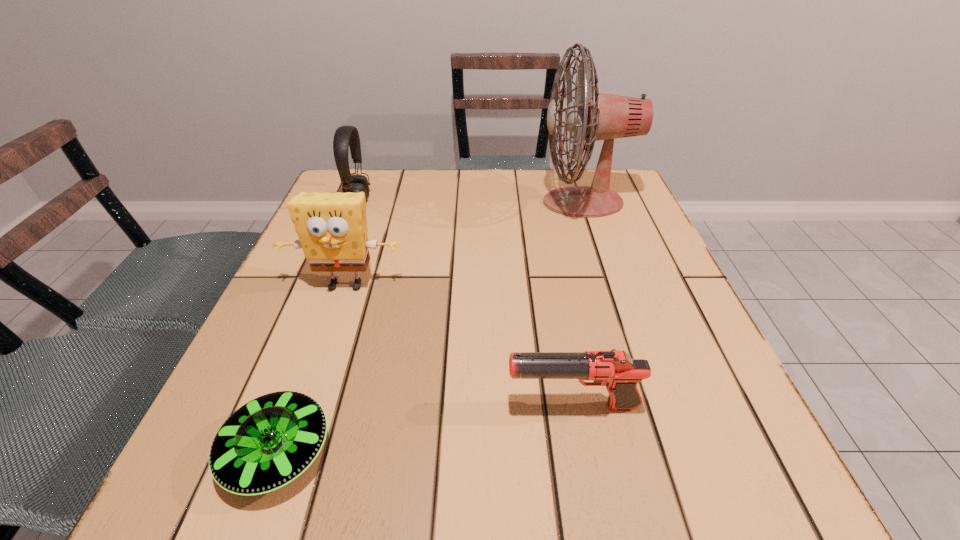
Locate an element on the screen. The height and width of the screenshot is (540, 960). fan positioned at the right edge is located at coordinates (594, 116).

Where is `gun located at the right edge`? gun located at the right edge is located at coordinates (616, 370).

Image resolution: width=960 pixels, height=540 pixels. I want to click on object that is positioned at the far left corner, so click(x=345, y=136).

At what (x,y) coordinates should I click in order to perform the action: click on object situated at the near left corner. Please return your answer as a coordinate pair (x, y). Looking at the image, I should click on (270, 441).

At what (x,y) coordinates should I click in order to perform the action: click on object located at the far right corner. Please return your answer as a coordinate pair (x, y). This screenshot has width=960, height=540. Looking at the image, I should click on (594, 116).

At what (x,y) coordinates should I click in order to perform the action: click on vacant region at the far edge of the desktop. Please return your answer as a coordinate pair (x, y). The width and height of the screenshot is (960, 540). Looking at the image, I should click on (437, 206).

The height and width of the screenshot is (540, 960). In the image, there is a desktop. In order to click on vacant space at the near edge in this screenshot , I will do `click(374, 467)`.

Identify the location of vacant space at the left edge of the desktop. The image size is (960, 540). (324, 288).

Where is `blank space at the right edge`? This screenshot has width=960, height=540. blank space at the right edge is located at coordinates (654, 352).

Identify the location of vacant space at the far left corner. pyautogui.click(x=354, y=169).